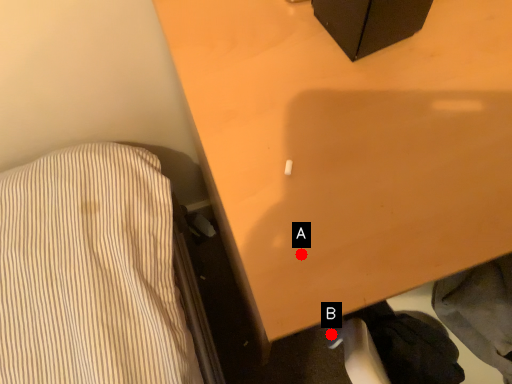
Question: Two points are circled on the image, labeled by A and B beside each circle. Which point is farther from the camera taking this photo?

Choices:
 (A) A is further
 (B) B is further

Answer: (B)